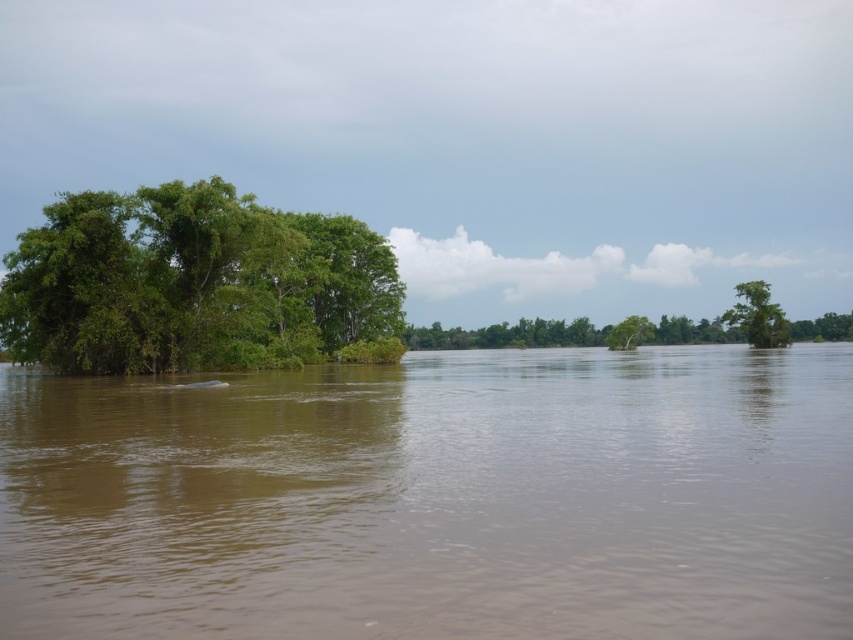
Which is above, green leafy tree at right or green leafy tree at center?

green leafy tree at center is higher up.

Is green leafy tree at right shorter than green leafy tree at center?

No, green leafy tree at right is not shorter than green leafy tree at center.

Locate an element on the screen. The image size is (853, 640). green leafy tree at right is located at coordinates (757, 316).

Is brown muddy water at center positioned behind green leafy tree at center?

No, it is in front of green leafy tree at center.

Does brown muddy water at center have a smaller size compared to green leafy tree at center?

Indeed, brown muddy water at center has a smaller size compared to green leafy tree at center.

This screenshot has height=640, width=853. Describe the element at coordinates (437, 499) in the screenshot. I see `brown muddy water at center` at that location.

Locate an element on the screen. brown muddy water at center is located at coordinates (437, 499).

Does point (195, 616) come closer to viewer compared to point (363, 253)?

Yes, point (195, 616) is in front of point (363, 253).

Between brown muddy water at center and green leafy tree at left, which one is positioned higher?

green leafy tree at left is above.

Locate an element on the screen. This screenshot has width=853, height=640. brown muddy water at center is located at coordinates (437, 499).